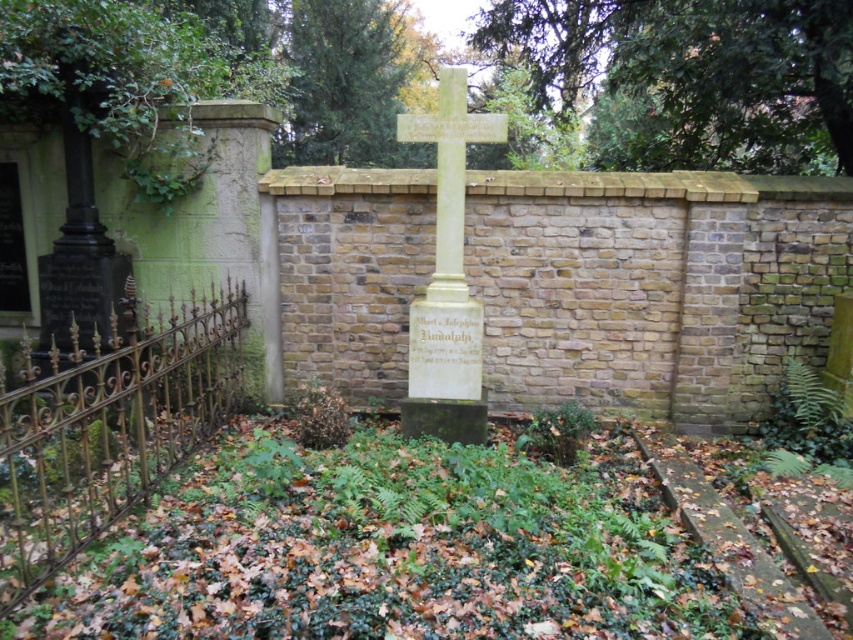
You are a visitor to the cemetery and want to take a photo of the gold wrought iron fence at left and the light yellow stone cross at center. From your current position, which object is closer to the camera?

The gold wrought iron fence at left is positioned under the light yellow stone cross at center, meaning it is closer to the camera.

You are standing in the cemetery and want to know how far the point at coordinates (x=238, y=333) is from you. Can you determine the distance?

The point at coordinates (x=238, y=333) is 4.84 meters away from the viewer.

You are a visitor at the cemetery and want to take a photo of both the gold wrought iron fence at left and the light yellow stone cross at center. Since you want both to be clearly visible in the frame, which object should you position closer to the camera to ensure the smaller one is still visible?

The light yellow stone cross at center is smaller than the gold wrought iron fence at left. To ensure both are clearly visible, position the light yellow stone cross at center closer to the camera so its smaller size is compensated by proximity.